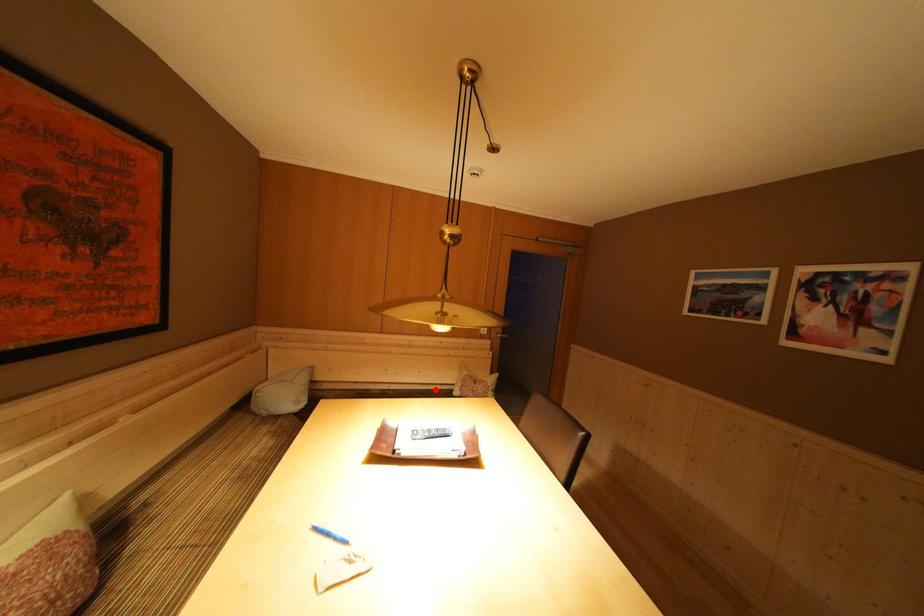
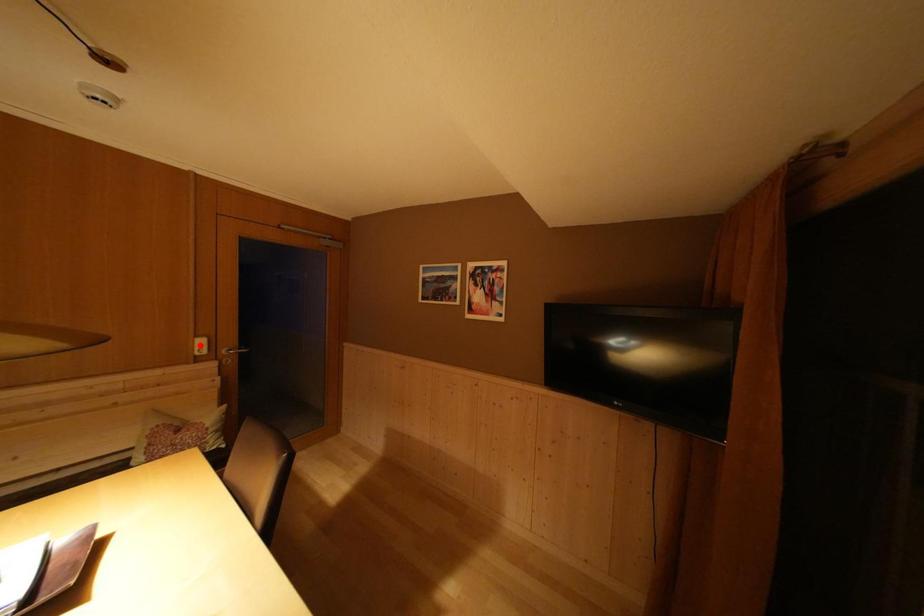
I am providing you with two images of the same scene from different viewpoints. A red point is marked on the first image and another point is marked on the second image. Do the highlighted points in image1 and image2 indicate the same real-world spot?

No